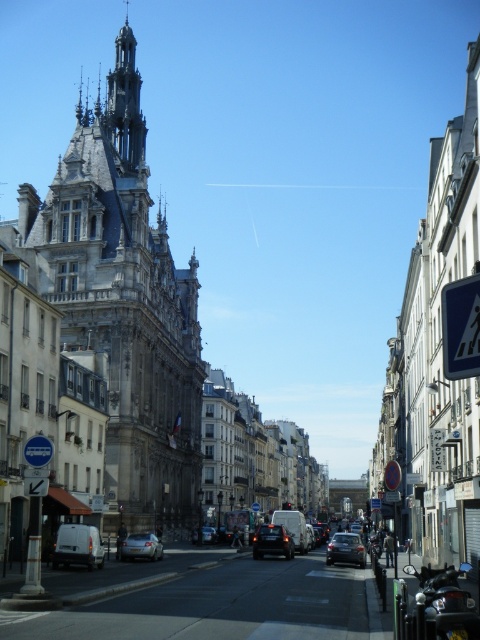
Where is `blue plastic sign at lower left`? The width and height of the screenshot is (480, 640). blue plastic sign at lower left is located at coordinates (37, 451).

Who is higher up, blue plastic sign at lower left or blue plastic arrow at lower left?

blue plastic sign at lower left is above.

Between point (52, 451) and point (43, 496), which one is positioned in front?

Point (43, 496) is more forward.

You are a GUI agent. You are given a task and a screenshot of the screen. Output one action in this format:
    pyautogui.click(x=<x>, y=<y>)
    Task: Click on the blue plastic sign at lower left
    Image resolution: width=480 pixels, height=640 pixels.
    Given the screenshot: What is the action you would take?
    pyautogui.click(x=37, y=451)

Is black plastic pedestrian crossing sign at right taller than blue plastic arrow at lower left?

Indeed, black plastic pedestrian crossing sign at right has a greater height compared to blue plastic arrow at lower left.

Is black plastic pedestrian crossing sign at right thinner than blue plastic arrow at lower left?

Incorrect, black plastic pedestrian crossing sign at right's width is not less than blue plastic arrow at lower left's.

This screenshot has height=640, width=480. In order to click on black plastic pedestrian crossing sign at right in this screenshot , I will do `click(460, 326)`.

Based on the photo, which is more to the left, silver metallic car at lower left or shiny silver car at center?

From the viewer's perspective, silver metallic car at lower left appears more on the left side.

Looking at this image, is silver metallic car at lower left thinner than shiny silver car at center?

In fact, silver metallic car at lower left might be wider than shiny silver car at center.

Is point (153, 557) positioned before point (204, 534)?

That is True.

I want to click on silver metallic car at lower left, so pos(141,547).